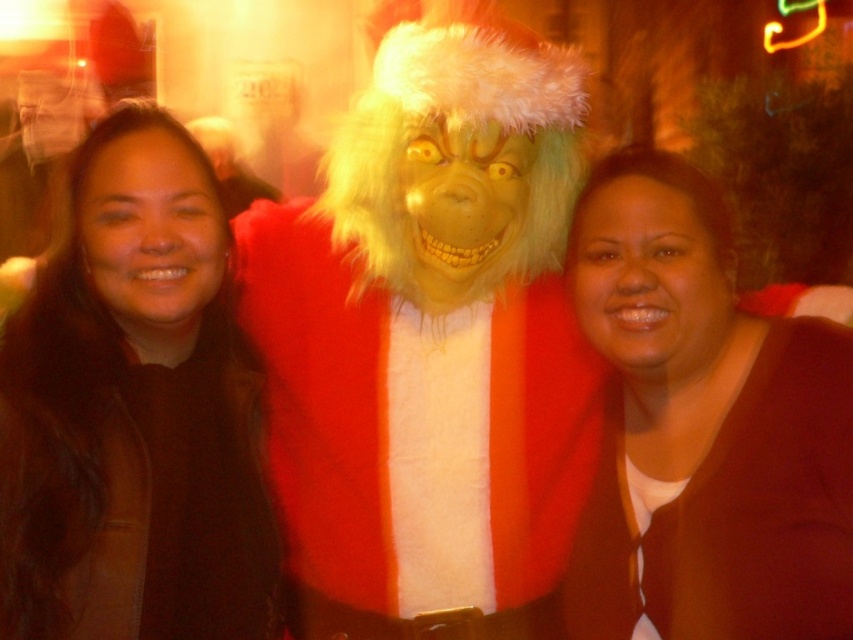
You are a photographer standing in front of the fuzzy red coat at center. You want to take a photo of it but need to be exactly 1.5 meters away to focus properly. Can you step back to achieve this distance?

The fuzzy red coat at center and viewer are 1.37 meters apart from each other. Since 1.37 meters is less than 1.5 meters, you need to step back approximately 0.13 meters to reach the required distance.

You are a photographer trying to adjust the lighting for a photo shoot. You notice the fuzzy red coat at center and the dark brown leather jacket at center. Which object is covering part of the other one?

The fuzzy red coat at center is positioned over the dark brown leather jacket at center, so it is covering part of it.

You are standing in front of the image and notice the dark brown leather jacket at center. Can you determine its exact position using the coordinate system provided?

The dark brown leather jacket at center is located at point (132,412) according to the coordinate system provided.